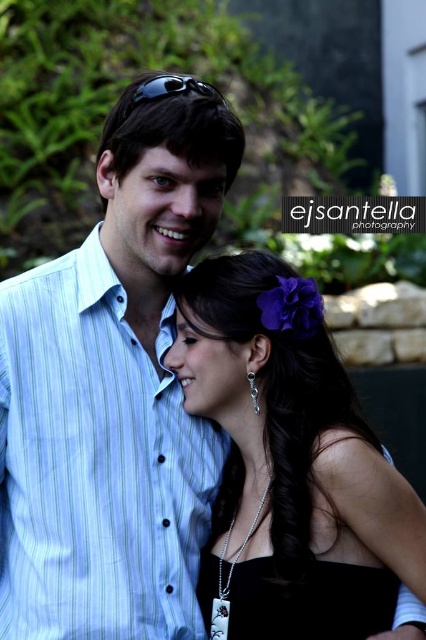
You are taking a photo of two people in the scene. The man is at point [92,260] and the woman is at point [210,92]. To ensure the woman is fully visible in the photo, should you adjust the camera to focus on the man or the woman?

Point [92,260] is behind point [210,92], so you should focus on the woman at point [210,92] to ensure she is fully visible since she is in front.

You are a photographer setting up a shoot. You have two outfits to feature in the photo, the blue striped shirt at upper left and the black satin dress at center. Based on their positions and sizes in the image, which outfit takes up more vertical space in the frame?

The blue striped shirt at upper left has a greater height compared to the black satin dress at center, so it takes up more vertical space in the frame.

You are an artist trying to sketch this scene. You need to place the blue striped shirt at upper left accurately. What are the coordinates for its position?

The coordinates for the blue striped shirt at upper left are at point (94, 465).